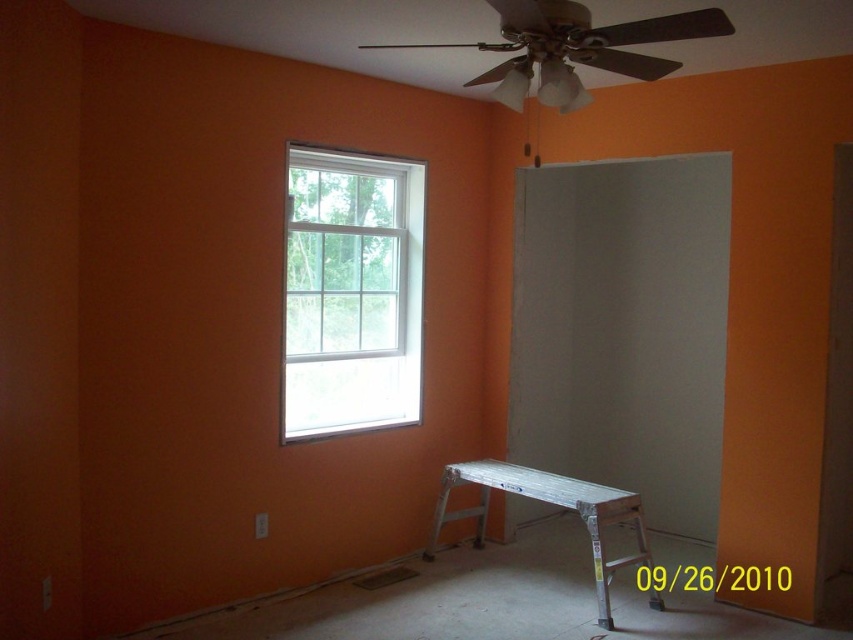
Who is more distant from viewer, (381, 246) or (573, 481)?

The point (381, 246) is behind.

Between point (384, 321) and point (607, 512), which one is positioned in front?

Point (607, 512) is in front.

I want to click on clear glass window at upper left, so click(x=351, y=291).